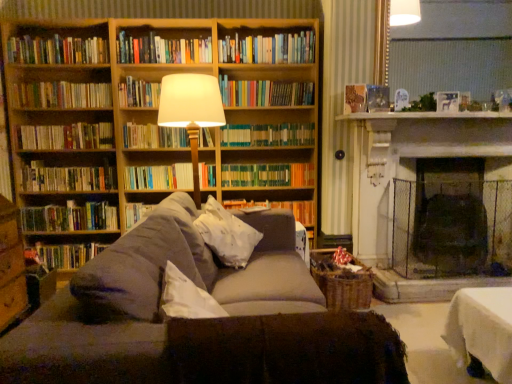
At what (x,y) coordinates should I click in order to perform the action: click on hardcover books at left, arranged as the eighth book when viewed from the top. Please return your answer as a coordinate pair (x, y). Looking at the image, I should click on (66, 136).

What are the coordinates of `hardcover books at center, arranged as the 11th book when viewed from the top` in the screenshot? It's located at (159, 177).

In order to face hardcover books at left, the 2th book in the bottom-to-top sequence, should I rotate leftwards or rightwards?

Rotate your view left by about 23.117°.

This screenshot has height=384, width=512. I want to click on green matte bookshelf at center, which is counted as the 6th book, starting from the bottom, so click(268, 175).

From the image's perspective, which one is positioned lower, green matte bookshelf at center, which is counted as the 6th book, starting from the bottom, or hardcover book at center, positioned as the 12th book in top-to-bottom order?

hardcover book at center, positioned as the 12th book in top-to-bottom order.

How many degrees apart are the facing directions of green matte bookshelf at center, which appears as the 9th book when viewed from the top, and hardcover book at center, which is counted as the third book, starting from the bottom?

0.000954 degrees separate the facing orientations of green matte bookshelf at center, which appears as the 9th book when viewed from the top, and hardcover book at center, which is counted as the third book, starting from the bottom.

Would you say hardcover book at center, positioned as the 12th book in top-to-bottom order, is part of green matte bookshelf at center, which appears as the 9th book when viewed from the top,'s contents?

No, hardcover book at center, positioned as the 12th book in top-to-bottom order, is located outside of green matte bookshelf at center, which appears as the 9th book when viewed from the top.

Is green matte bookshelf at center, which appears as the 9th book when viewed from the top, touching hardcover book at center, positioned as the 12th book in top-to-bottom order?

green matte bookshelf at center, which appears as the 9th book when viewed from the top, and hardcover book at center, positioned as the 12th book in top-to-bottom order, are not in contact.

Based on the photo, is green matte bookshelf at center, which appears as the 9th book when viewed from the top, completely or partially inside hardcover books at upper center, the fourteenth book positioned from the bottom?

No, hardcover books at upper center, the fourteenth book positioned from the bottom, does not contain green matte bookshelf at center, which appears as the 9th book when viewed from the top.

Which object is further away from the camera, hardcover books at upper center, the 1th book when ordered from top to bottom, or green matte bookshelf at center, which is counted as the 6th book, starting from the bottom?

green matte bookshelf at center, which is counted as the 6th book, starting from the bottom.

From the image's perspective, which one is positioned higher, matte white lampshade at center or hardcover books at center, which is counted as the fourth book, starting from the bottom?

matte white lampshade at center, from the image's perspective.

From the picture: From a real-world perspective, is matte white lampshade at center positioned over hardcover books at center, arranged as the 11th book when viewed from the top, based on gravity?

Yes, from a real-world perspective, matte white lampshade at center is on top of hardcover books at center, arranged as the 11th book when viewed from the top.

Considering the relative sizes of matte white lampshade at center and hardcover books at center, which is counted as the fourth book, starting from the bottom, in the image provided, is matte white lampshade at center thinner than hardcover books at center, which is counted as the fourth book, starting from the bottom,?

No, matte white lampshade at center is not thinner than hardcover books at center, which is counted as the fourth book, starting from the bottom.

Is matte white lampshade at center not close to hardcover books at center, arranged as the 11th book when viewed from the top?

No, matte white lampshade at center is not far away from hardcover books at center, arranged as the 11th book when viewed from the top.

How many degrees apart are the facing directions of hardcover books at left, which ranks as the third book in top-to-bottom order, and hardcover book at upper center?

They differ by 9.24 degrees in their facing directions.

Does point (45, 50) appear closer or farther from the camera than point (344, 105)?

Point (45, 50) is positioned farther from the camera compared to point (344, 105).

Consider the image. Which object is further away from the camera, hardcover books at left, acting as the twelfth book starting from the bottom, or hardcover book at upper center?

hardcover books at left, acting as the twelfth book starting from the bottom, is behind.

Considering the sizes of woven brown basket at lower center and matte white lampshade at center in the image, is woven brown basket at lower center wider or thinner than matte white lampshade at center?

woven brown basket at lower center is wider than matte white lampshade at center.

Consider the image. Is woven brown basket at lower center aimed at matte white lampshade at center?

No, woven brown basket at lower center is not facing towards matte white lampshade at center.

Do you think woven brown basket at lower center is within matte white lampshade at center, or outside of it?

woven brown basket at lower center is outside matte white lampshade at center.

Which point is more distant from viewer, (x=348, y=277) or (x=207, y=95)?

The point (x=348, y=277) is farther.

Considering the relative positions of hardcover book at upper center and hardcover books at left, which appears as the 5th book when ordered from the bottom, in the image provided, is hardcover book at upper center behind hardcover books at left, which appears as the 5th book when ordered from the bottom,?

No, hardcover book at upper center is closer to the camera.

Is hardcover book at upper center shorter than hardcover books at left, which appears as the 5th book when ordered from the bottom?

Indeed, hardcover book at upper center has a lesser height compared to hardcover books at left, which appears as the 5th book when ordered from the bottom.

At what (x,y) coordinates should I click in order to perform the action: click on book that is the 6th one when counting backward from the hardcover book at upper center. Please return your answer as a coordinate pair (x, y). The width and height of the screenshot is (512, 384). Looking at the image, I should click on (67, 178).

Considering the sizes of objects white soft pillow at center and multicolored hardcover books at center, which is counted as the fourth book, starting from the top, in the image provided, who is smaller, white soft pillow at center or multicolored hardcover books at center, which is counted as the fourth book, starting from the top,?

Smaller between the two is multicolored hardcover books at center, which is counted as the fourth book, starting from the top.

Which object is positioned more to the left, white soft pillow at center or multicolored hardcover books at center, the eleventh book when ordered from bottom to top?

From the viewer's perspective, white soft pillow at center appears more on the left side.

Could you tell me if white soft pillow at center is facing multicolored hardcover books at center, the eleventh book when ordered from bottom to top?

No.

Which of these two, white soft pillow at center or multicolored hardcover books at center, which is counted as the fourth book, starting from the top, stands taller?

white soft pillow at center is taller.

The height and width of the screenshot is (384, 512). I want to click on the 2nd book counting from the right of the green matte bookshelf at center, which is counted as the 6th book, starting from the bottom, so click(x=279, y=208).

Identify the location of the 3rd book counting from the left of the green matte bookshelf at center, which appears as the 9th book when viewed from the top. (162, 50).

Looking at the image, which one is located further to hardcover book at center, positioned as the 12th book in top-to-bottom order, wooden bookcase at upper left or green matte bookshelf at center, which is counted as the 6th book, starting from the bottom?

wooden bookcase at upper left lies further to hardcover book at center, positioned as the 12th book in top-to-bottom order, than the other object.

When comparing their distances from hardcover book at center, which is counted as the 9th book, starting from the bottom, does green matte bookshelf at center, which appears as the 9th book when viewed from the top, or wooden bookcase at upper left seem closer?

The object closer to hardcover book at center, which is counted as the 9th book, starting from the bottom, is wooden bookcase at upper left.

Based on the photo, estimate the real-world distances between objects in this image. Which object is further from wooden bookshelf at upper center, hardcover book at upper center or hardcover books at center, which is the 2th book from top to bottom?

hardcover book at upper center.

When comparing their distances from hardcover books at left, the 2th book in the bottom-to-top sequence, does hardcover books at left, which ranks as the third book in top-to-bottom order, or hardcover book at left, arranged as the 1th book when ordered from the bottom, seem further?

hardcover books at left, which ranks as the third book in top-to-bottom order, lies further to hardcover books at left, the 2th book in the bottom-to-top sequence, than the other object.

When comparing their distances from hardcover books at center, which is counted as the 13th book, starting from the bottom, does green matte bookshelf at center, which is counted as the 6th book, starting from the bottom, or hardcover books at center, which is counted as the fourth book, starting from the bottom, seem further?

hardcover books at center, which is counted as the fourth book, starting from the bottom.

Which object lies further to the anchor point hardcover books at left, arranged as the eighth book when viewed from the top, hardcover books at left, acting as the twelfth book starting from the bottom, or green matte bookshelf at center, which is counted as the 6th book, starting from the bottom?

green matte bookshelf at center, which is counted as the 6th book, starting from the bottom, is further to hardcover books at left, arranged as the eighth book when viewed from the top.

Considering their positions, is hardcover books at left, acting as the twelfth book starting from the bottom, positioned further to hardcover book at left, arranged as the 1th book when ordered from the bottom, than hardcover books at center, which is counted as the 13th book, starting from the bottom?

hardcover books at center, which is counted as the 13th book, starting from the bottom, is positioned further to the anchor hardcover book at left, arranged as the 1th book when ordered from the bottom.

Considering their positions, is hardcover books at center, which is counted as the fourth book, starting from the bottom, positioned further to white soft pillow at center than woven brown basket at lower center?

hardcover books at center, which is counted as the fourth book, starting from the bottom, is further to white soft pillow at center.

The width and height of the screenshot is (512, 384). In order to click on table lamp situated between hardcover books at left, which appears as the 5th book when ordered from the bottom, and hardcover books at center, which is counted as the 13th book, starting from the bottom, from left to right in this screenshot , I will do click(x=191, y=111).

At what (x,y) coordinates should I click in order to perform the action: click on basket between gray fabric couch at center and green matte bookshelf at center, which appears as the 9th book when viewed from the top, from front to back. Please return your answer as a coordinate pair (x, y). The height and width of the screenshot is (384, 512). Looking at the image, I should click on (342, 282).

Where is `bookcase between hardcover books at left, acting as the seventh book starting from the bottom, and hardcover books at upper center, the fourteenth book positioned from the bottom`? This screenshot has width=512, height=384. bookcase between hardcover books at left, acting as the seventh book starting from the bottom, and hardcover books at upper center, the fourteenth book positioned from the bottom is located at coordinates (155, 114).

The image size is (512, 384). I want to click on bookcase between hardcover books at left, acting as the twelfth book starting from the bottom, and matte white lampshade at center from left to right, so pos(155,114).